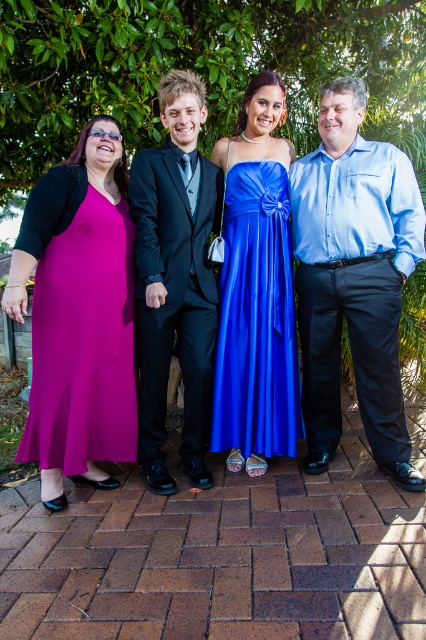
From the picture: You are a photographer planning to take a photo of the two blue dresses at center. The matte blue dress at center is taller than the satin blue dress at center. Which dress should you focus on first to ensure proper framing?

The matte blue dress at center is taller than the satin blue dress at center, so you should focus on the matte blue dress at center first to ensure proper framing.

You are a photographer trying to capture a group photo of the matte blue dress at center and the satin blue dress at center. The camera you are using has a minimum focus distance of 25 centimeters. Will you be able to focus on both dresses without moving the camera closer?

The distance between the matte blue dress at center and the satin blue dress at center is 24.57 centimeters. Since the minimum focus distance of the camera is 25 centimeters, the camera cannot focus on both dresses simultaneously without moving closer because the current distance is slightly less than the required minimum.

You are a photographer trying to capture a group photo of the matte blue dress at center and the shiny black suit at center. Since the background is very bright, you want to ensure that the subjects are well lit. Which subject should you adjust the camera focus on first to ensure proper exposure?

The matte blue dress at center is below shiny black suit at center, so you should focus on the shiny black suit at center first because it is higher and closer to the bright background, ensuring it receives adequate light without overexposure.